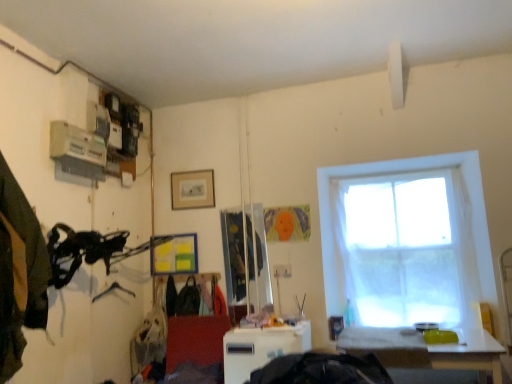
Question: Does dark green fabric at left, positioned as the 3th clothing in back-to-front order, have a lesser width compared to white glossy table at lower right, which is the second table in left-to-right order?

Choices:
 (A) no
 (B) yes

Answer: (B)

Question: Is dark green fabric at left, positioned as the 3th clothing in back-to-front order, oriented towards white glossy table at lower right, which is the second table in left-to-right order?

Choices:
 (A) yes
 (B) no

Answer: (B)

Question: Is dark green fabric at left, the 3th clothing positioned from the right, bigger than white glossy table at lower right, which is the second table in left-to-right order?

Choices:
 (A) no
 (B) yes

Answer: (A)

Question: From a real-world perspective, is dark green fabric at left, positioned as the 3th clothing in back-to-front order, on white glossy table at lower right, which is the second table in left-to-right order?

Choices:
 (A) no
 (B) yes

Answer: (B)

Question: From the image's perspective, does dark green fabric at left, marked as the first clothing in a front-to-back arrangement, appear higher than white glossy table at lower right, marked as the 1th table in a right-to-left arrangement?

Choices:
 (A) yes
 (B) no

Answer: (A)

Question: Is white glossy table at lower right, marked as the 1th table in a right-to-left arrangement, a part of dark green fabric at left, the 3th clothing positioned from the right?

Choices:
 (A) yes
 (B) no

Answer: (B)

Question: Would you say metallic silver hanger at lower left contains matte black backpack at center, arranged as the 3th clothing when viewed from the left?

Choices:
 (A) yes
 (B) no

Answer: (B)

Question: Is metallic silver hanger at lower left positioned in front of matte black backpack at center, acting as the second clothing starting from the back?

Choices:
 (A) no
 (B) yes

Answer: (B)

Question: Is metallic silver hanger at lower left thinner than matte black backpack at center, acting as the second clothing starting from the back?

Choices:
 (A) yes
 (B) no

Answer: (A)

Question: From a real-world perspective, is metallic silver hanger at lower left over matte black backpack at center, arranged as the 3th clothing when viewed from the left?

Choices:
 (A) yes
 (B) no

Answer: (A)

Question: Is the surface of metallic silver hanger at lower left in direct contact with matte black backpack at center, which appears as the 1th clothing when viewed from the right?

Choices:
 (A) yes
 (B) no

Answer: (B)

Question: Is metallic silver hanger at lower left aimed at matte black backpack at center, which appears as the second clothing when viewed from the front?

Choices:
 (A) yes
 (B) no

Answer: (B)

Question: Is white plastic table at center, the second table from the right, outside of dark green fabric at left, which is the 1th clothing from left to right?

Choices:
 (A) yes
 (B) no

Answer: (A)